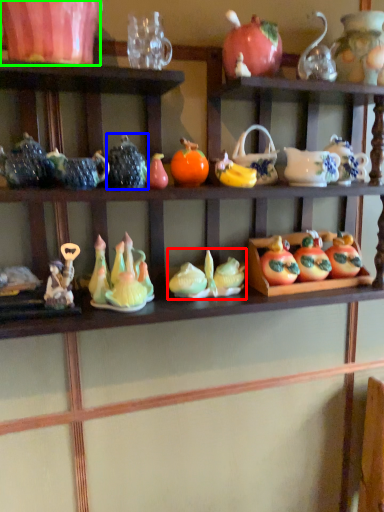
Question: Which is farther away from toy (highlighted by a red box)? tableware (highlighted by a blue box) or tableware (highlighted by a green box)?

Choices:
 (A) tableware
 (B) tableware

Answer: (B)